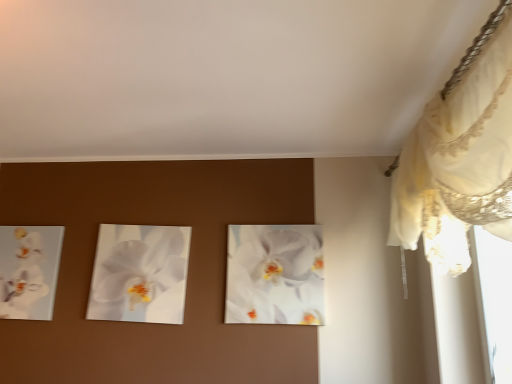
What is the approximate width of white glossy orchid at center, which is the 3th flower in left-to-right order?

4.09 centimeters.

What do you see at coordinates (136, 271) in the screenshot? This screenshot has height=384, width=512. I see `white glossy orchid at center, the 2th flower when ordered from right to left` at bounding box center [136, 271].

Based on the photo, measure the distance between white glossy orchid at left, which ranks as the third flower in right-to-left order, and camera.

white glossy orchid at left, which ranks as the third flower in right-to-left order, is 8.30 feet away from camera.

I want to click on white glossy orchid at center, positioned as the first flower in right-to-left order, so point(275,275).

Which flower is the 2nd one when counting from the right side of the white glossy orchid at left, which ranks as the third flower in right-to-left order? Please provide its 2D coordinates.

[(275, 275)]

Is white glossy orchid at left, which appears as the 1th flower when viewed from the left, taller than white glossy orchid at center, positioned as the first flower in right-to-left order?

No.

Does point (35, 272) come behind point (309, 269)?

Yes, point (35, 272) is farther from viewer.

Between white glossy orchid at left, which appears as the 1th flower when viewed from the left, and white glossy orchid at center, positioned as the first flower in right-to-left order, which one has larger size?

Bigger between the two is white glossy orchid at center, positioned as the first flower in right-to-left order.

Can you confirm if white glossy orchid at left, which ranks as the third flower in right-to-left order, is smaller than white lace curtain at upper right?

Indeed, white glossy orchid at left, which ranks as the third flower in right-to-left order, has a smaller size compared to white lace curtain at upper right.

Is point (30, 292) closer to viewer compared to point (503, 45)?

No, it is not.

From a real-world perspective, which is physically above, white glossy orchid at left, which appears as the 1th flower when viewed from the left, or white lace curtain at upper right?

white lace curtain at upper right, from a real-world perspective.

Is white glossy orchid at left, which ranks as the third flower in right-to-left order, positioned before white lace curtain at upper right?

No, white glossy orchid at left, which ranks as the third flower in right-to-left order, is further to the viewer.

Is white glossy orchid at center, which is the 3th flower in left-to-right order, further to camera compared to white glossy orchid at left, which appears as the 1th flower when viewed from the left?

No, white glossy orchid at center, which is the 3th flower in left-to-right order, is closer to the viewer.

Is white glossy orchid at center, positioned as the first flower in right-to-left order, not near white glossy orchid at left, which appears as the 1th flower when viewed from the left?

That's right, there is a large distance between white glossy orchid at center, positioned as the first flower in right-to-left order, and white glossy orchid at left, which appears as the 1th flower when viewed from the left.

Between white glossy orchid at center, which is the 3th flower in left-to-right order, and white glossy orchid at left, which ranks as the third flower in right-to-left order, which one appears on the left side from the viewer's perspective?

white glossy orchid at left, which ranks as the third flower in right-to-left order.

From a real-world perspective, which object rests below the other?

white glossy orchid at left, which ranks as the third flower in right-to-left order, from a real-world perspective.

Would you say white glossy orchid at center, which is the 2th flower from left to right, is part of white lace curtain at upper right's contents?

No.

Is white lace curtain at upper right not near white glossy orchid at center, the 2th flower when ordered from right to left?

That's right, there is a large distance between white lace curtain at upper right and white glossy orchid at center, the 2th flower when ordered from right to left.

In the image, is white glossy orchid at center, the 2th flower when ordered from right to left, on the left side or the right side of white lace curtain at upper right?

From the image, it's evident that white glossy orchid at center, the 2th flower when ordered from right to left, is to the left of white lace curtain at upper right.

Is white glossy orchid at center, which is the 2th flower from left to right, not close to white lace curtain at upper right?

Yes, white glossy orchid at center, which is the 2th flower from left to right, is far from white lace curtain at upper right.

From the image's perspective, is white glossy orchid at center, which is the 2th flower from left to right, beneath white lace curtain at upper right?

Yes, from the image's perspective, white glossy orchid at center, which is the 2th flower from left to right, is beneath white lace curtain at upper right.

Is white glossy orchid at center, which is the 2th flower from left to right, positioned behind white lace curtain at upper right?

Yes, white glossy orchid at center, which is the 2th flower from left to right, is further from the viewer.

Is there a large distance between white lace curtain at upper right and white glossy orchid at center, which is the 3th flower in left-to-right order?

That's not correct — white lace curtain at upper right is a little close to white glossy orchid at center, which is the 3th flower in left-to-right order.

Is white lace curtain at upper right positioned with its back to white glossy orchid at center, which is the 3th flower in left-to-right order?

No, white lace curtain at upper right is not facing the opposite direction of white glossy orchid at center, which is the 3th flower in left-to-right order.

Is white glossy orchid at center, which is the 3th flower in left-to-right order, located within white lace curtain at upper right?

No, white glossy orchid at center, which is the 3th flower in left-to-right order, is not a part of white lace curtain at upper right.

In the scene shown: Relative to white glossy orchid at center, which is the 3th flower in left-to-right order, is white lace curtain at upper right in front or behind?

Clearly, white lace curtain at upper right is in front of white glossy orchid at center, which is the 3th flower in left-to-right order.

How many degrees apart are the facing directions of white lace curtain at upper right and white glossy orchid at left, which ranks as the third flower in right-to-left order?

The angle between the facing direction of white lace curtain at upper right and the facing direction of white glossy orchid at left, which ranks as the third flower in right-to-left order, is 90.2 degrees.

From a real-world perspective, which is physically below, white lace curtain at upper right or white glossy orchid at left, which appears as the 1th flower when viewed from the left?

white glossy orchid at left, which appears as the 1th flower when viewed from the left.

Considering the positions of objects white lace curtain at upper right and white glossy orchid at left, which appears as the 1th flower when viewed from the left, in the image provided, who is more to the left, white lace curtain at upper right or white glossy orchid at left, which appears as the 1th flower when viewed from the left,?

white glossy orchid at left, which appears as the 1th flower when viewed from the left, is more to the left.

In terms of height, does white lace curtain at upper right look taller or shorter compared to white glossy orchid at left, which ranks as the third flower in right-to-left order?

white lace curtain at upper right is taller than white glossy orchid at left, which ranks as the third flower in right-to-left order.

Identify the location of the 2nd flower located above the white glossy orchid at left, which ranks as the third flower in right-to-left order (from a real-world perspective). (275, 275).

In order to click on curtain that is above the white glossy orchid at left, which ranks as the third flower in right-to-left order (from the image's perspective) in this screenshot , I will do `click(460, 156)`.

Based on the photo, considering their positions, is white lace curtain at upper right positioned closer to white glossy orchid at left, which appears as the 1th flower when viewed from the left, than white glossy orchid at center, which is the 2th flower from left to right?

Among the two, white glossy orchid at center, which is the 2th flower from left to right, is located nearer to white glossy orchid at left, which appears as the 1th flower when viewed from the left.

Looking at the image, which one is located closer to white glossy orchid at center, the 2th flower when ordered from right to left, white glossy orchid at center, positioned as the first flower in right-to-left order, or white lace curtain at upper right?

white glossy orchid at center, positioned as the first flower in right-to-left order, is positioned closer to the anchor white glossy orchid at center, the 2th flower when ordered from right to left.

Considering their positions, is white lace curtain at upper right positioned further to white glossy orchid at center, which is the 2th flower from left to right, than white glossy orchid at center, positioned as the first flower in right-to-left order?

Based on the image, white lace curtain at upper right appears to be further to white glossy orchid at center, which is the 2th flower from left to right.

When comparing their distances from white glossy orchid at left, which ranks as the third flower in right-to-left order, does white glossy orchid at center, which is the 2th flower from left to right, or white glossy orchid at center, which is the 3th flower in left-to-right order, seem closer?

white glossy orchid at center, which is the 2th flower from left to right, lies closer to white glossy orchid at left, which ranks as the third flower in right-to-left order, than the other object.

Considering their positions, is white glossy orchid at center, which is the 2th flower from left to right, positioned further to white lace curtain at upper right than white glossy orchid at left, which appears as the 1th flower when viewed from the left?

white glossy orchid at left, which appears as the 1th flower when viewed from the left, lies further to white lace curtain at upper right than the other object.

Based on their spatial positions, is white glossy orchid at center, which is the 2th flower from left to right, or white lace curtain at upper right closer to white glossy orchid at left, which appears as the 1th flower when viewed from the left?

The object closer to white glossy orchid at left, which appears as the 1th flower when viewed from the left, is white glossy orchid at center, which is the 2th flower from left to right.

Estimate the real-world distances between objects in this image. Which object is further from white glossy orchid at center, which is the 2th flower from left to right, white glossy orchid at left, which ranks as the third flower in right-to-left order, or white lace curtain at upper right?

white lace curtain at upper right.

Estimate the real-world distances between objects in this image. Which object is further from white lace curtain at upper right, white glossy orchid at left, which ranks as the third flower in right-to-left order, or white glossy orchid at center, which is the 3th flower in left-to-right order?

Based on the image, white glossy orchid at left, which ranks as the third flower in right-to-left order, appears to be further to white lace curtain at upper right.

The width and height of the screenshot is (512, 384). I want to click on flower between white glossy orchid at left, which ranks as the third flower in right-to-left order, and white glossy orchid at center, positioned as the first flower in right-to-left order, so click(x=136, y=271).

The image size is (512, 384). In order to click on flower located between white glossy orchid at center, which is the 2th flower from left to right, and white lace curtain at upper right in the left-right direction in this screenshot , I will do `click(275, 275)`.